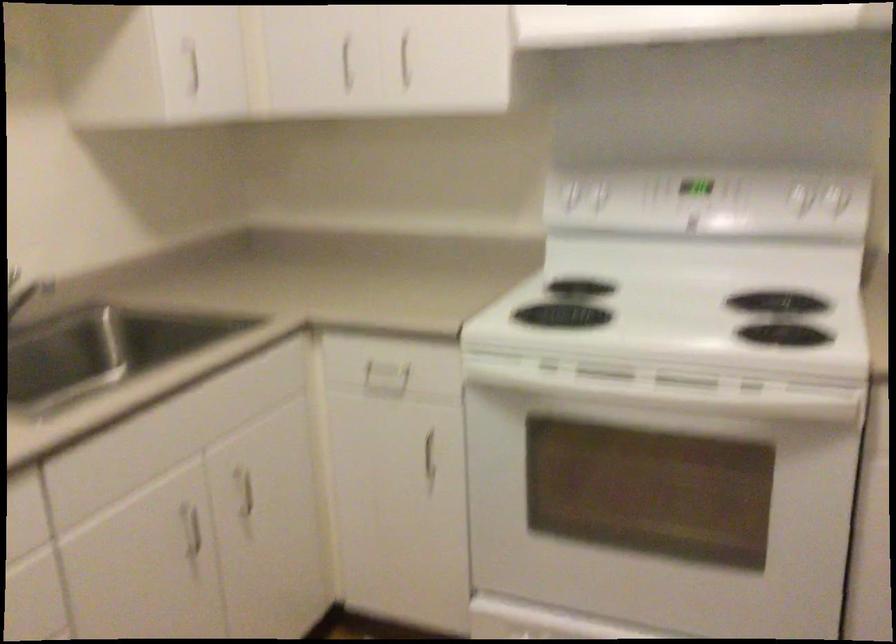
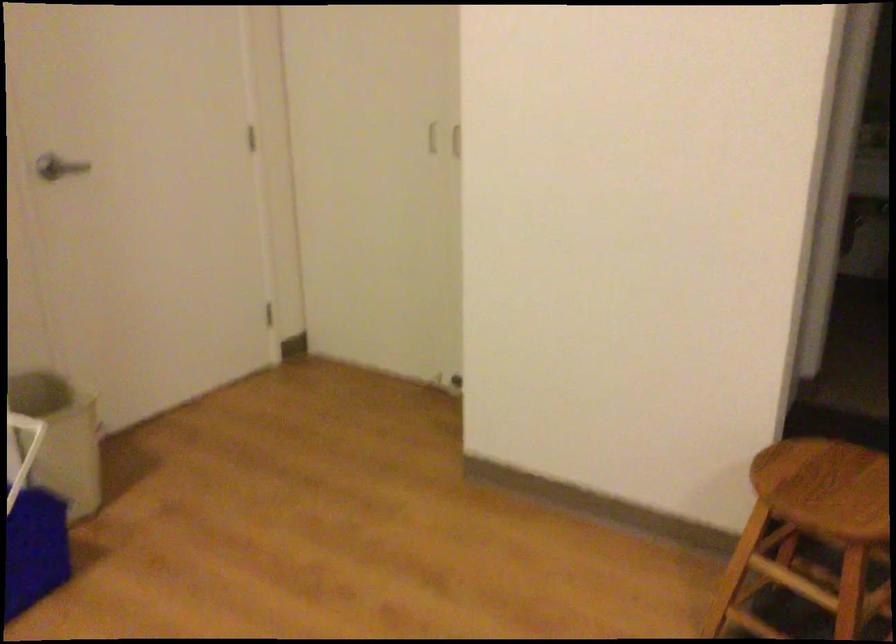
Question: The images are taken continuously from a first-person perspective. In which direction is your viewpoint rotating?

Choices:
 (A) Left
 (B) Right
 (C) Up
 (D) Down

Answer: (B)